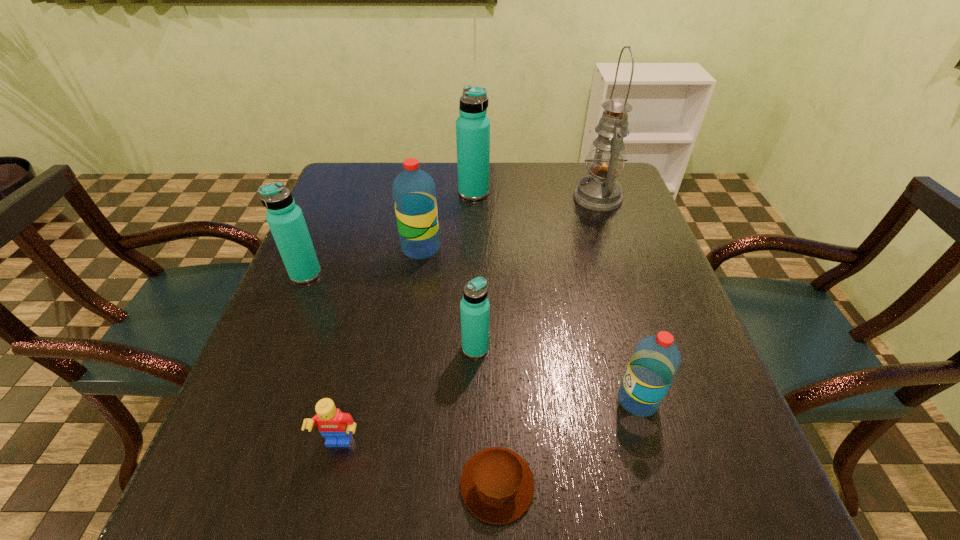
Where is `oil lamp`? Image resolution: width=960 pixels, height=540 pixels. oil lamp is located at coordinates (599, 191).

The image size is (960, 540). In order to click on gray oil lamp in this screenshot , I will do `click(599, 191)`.

At what (x,y) coordinates should I click in order to perform the action: click on the farthest blue water bottle. Please return your answer as a coordinate pair (x, y). This screenshot has width=960, height=540. Looking at the image, I should click on (472, 126).

Locate an element on the screen. the tallest water bottle is located at coordinates (472, 126).

Where is `the leftmost water bottle`? the leftmost water bottle is located at coordinates 285,219.

Find the location of a particular element. The image size is (960, 540). the leftmost object is located at coordinates (285, 219).

At what (x,y) coordinates should I click in order to perform the action: click on the fourth water bottle from right to left. Please return your answer as a coordinate pair (x, y). Looking at the image, I should click on (414, 193).

Where is `the third object from left to right`? The height and width of the screenshot is (540, 960). the third object from left to right is located at coordinates (414, 193).

Find the location of `the nearest blue water bottle`. the nearest blue water bottle is located at coordinates (474, 307).

Where is `the fifth farthest object`? The height and width of the screenshot is (540, 960). the fifth farthest object is located at coordinates (474, 307).